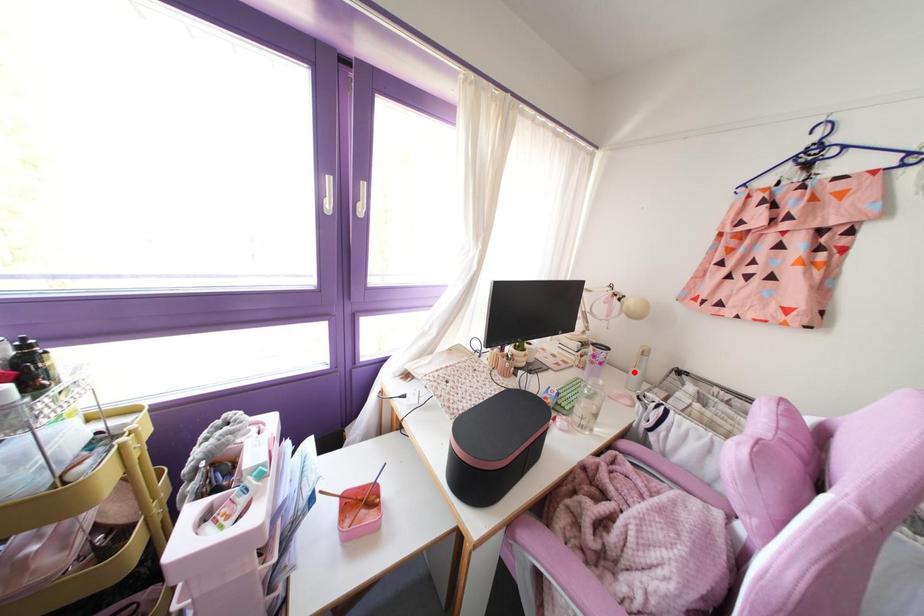
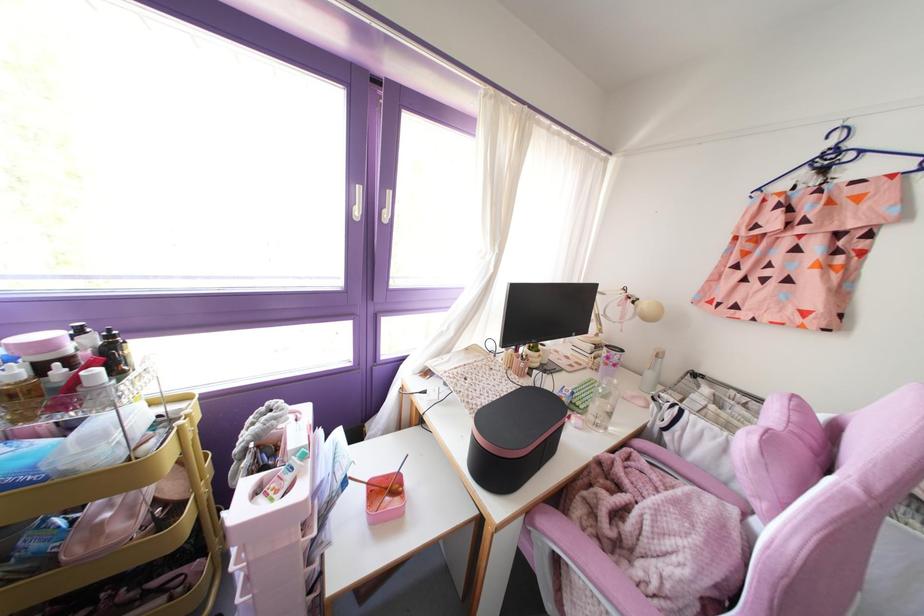
Where in the second image is the point corresponding to the highlighted location from the first image?

(649, 374)